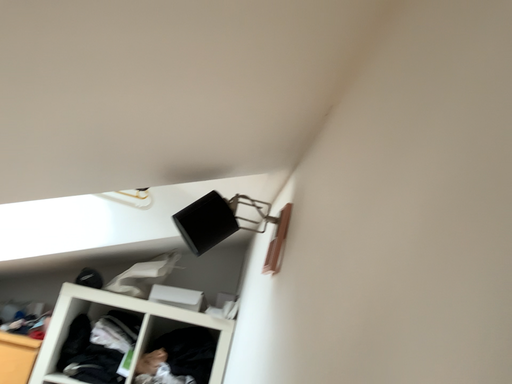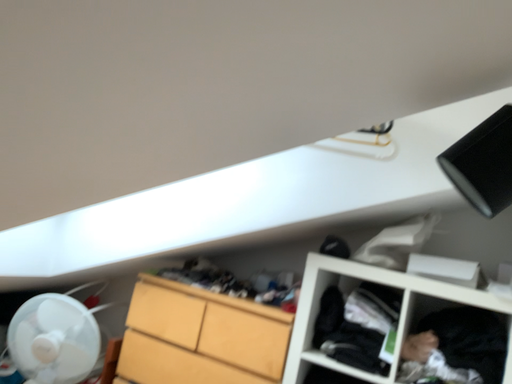
Question: How did the camera likely rotate when shooting the video?

Choices:
 (A) rotated right
 (B) rotated left

Answer: (B)